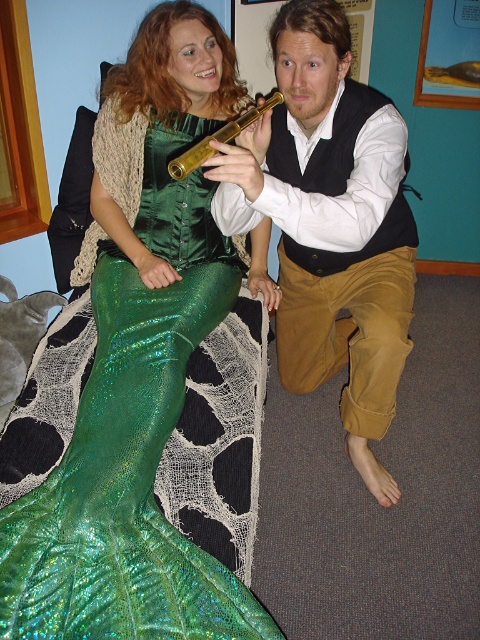
Question: Which point is farther to the camera?

Choices:
 (A) (320, 140)
 (B) (93, 525)

Answer: (A)

Question: Which point is closer to the camera?

Choices:
 (A) shiny green fabric at lower left
 (B) matte black vest at center

Answer: (A)

Question: Does shiny green fabric at lower left have a smaller size compared to matte black vest at center?

Choices:
 (A) no
 (B) yes

Answer: (B)

Question: Does shiny green fabric at lower left have a greater width compared to matte black vest at center?

Choices:
 (A) yes
 (B) no

Answer: (A)

Question: Is shiny green fabric at lower left positioned at the back of matte black vest at center?

Choices:
 (A) yes
 (B) no

Answer: (B)